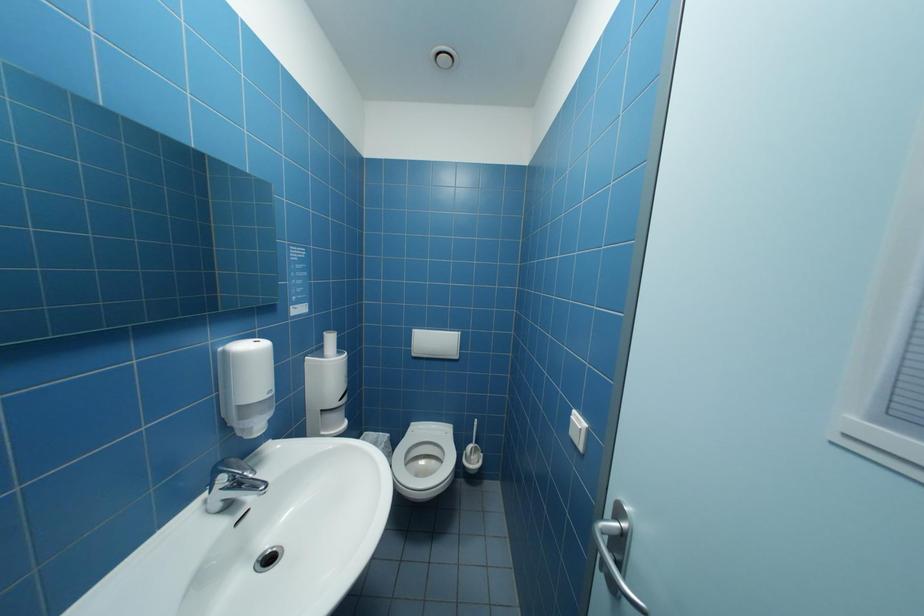
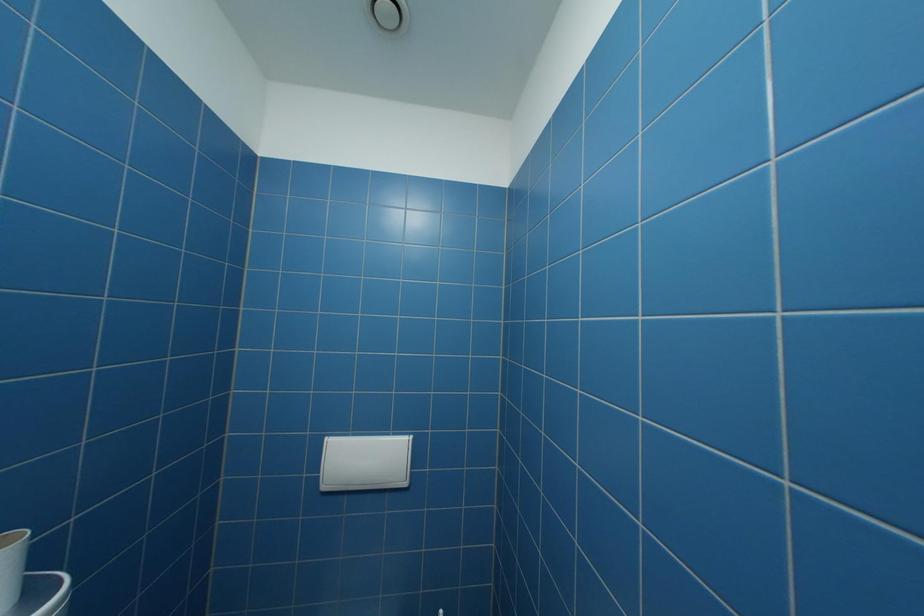
Question: The images are taken continuously from a first-person perspective. In which direction are you moving?

Choices:
 (A) Left
 (B) Right
 (C) Forward
 (D) Backward

Answer: (C)